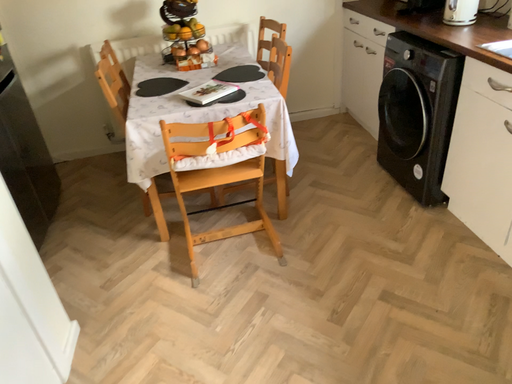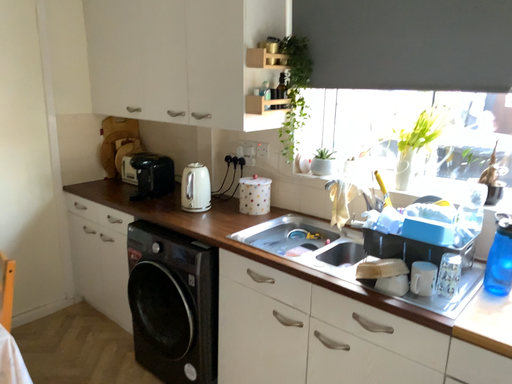
Question: Which way did the camera rotate in the video?

Choices:
 (A) rotated left
 (B) rotated right

Answer: (B)